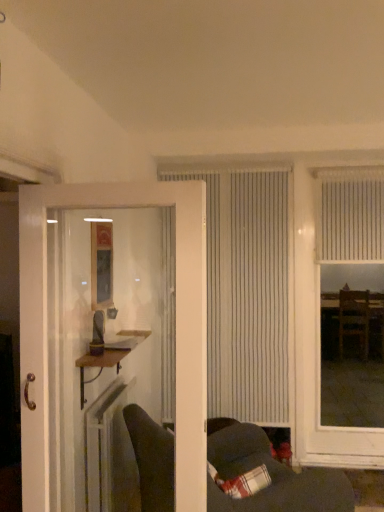
What do you see at coordinates (350, 215) in the screenshot? I see `white textured blind at upper right` at bounding box center [350, 215].

What is the approximate height of white plastic radiator at lower left?

32.47 inches.

At what (x,y) coordinates should I click in order to perform the action: click on dark gray fabric couch at lower center. Please return your answer as a coordinate pair (x, y). Looking at the image, I should click on (272, 477).

Locate an element on the screen. This screenshot has height=512, width=384. plaid fabric pillow at lower right is located at coordinates (242, 482).

Does white vertical blinds at right, which ranks as the first window in right-to-left order, turn towards white textured blind at upper right?

Result: Yes, white vertical blinds at right, which ranks as the first window in right-to-left order, is oriented towards white textured blind at upper right.

Consider the image. Considering the sizes of objects white vertical blinds at right, which ranks as the first window in right-to-left order, and white textured blind at upper right in the image provided, who is wider, white vertical blinds at right, which ranks as the first window in right-to-left order, or white textured blind at upper right?

white vertical blinds at right, which ranks as the first window in right-to-left order.

Considering the relative positions of white vertical blinds at right, placed as the second window when sorted from left to right, and white textured blind at upper right in the image provided, is white vertical blinds at right, placed as the second window when sorted from left to right, behind white textured blind at upper right?

That is False.

From the image's perspective, is white vertical blinds at right, which ranks as the first window in right-to-left order, located above white textured blind at upper right?

No, from the image's perspective, white vertical blinds at right, which ranks as the first window in right-to-left order, is not above white textured blind at upper right.

Consider the image. From a real-world perspective, which is physically above, dark gray fabric couch at lower center or white plastic radiator at lower left?

From a 3D spatial view, white plastic radiator at lower left is above.

Choose the correct answer: Is dark gray fabric couch at lower center inside white plastic radiator at lower left or outside it?

dark gray fabric couch at lower center lies outside white plastic radiator at lower left.

Is point (233, 446) positioned behind point (127, 450)?

Yes, point (233, 446) is farther from viewer.

From the image's perspective, between dark gray fabric couch at lower center and white plastic radiator at lower left, which one is located above?

white plastic radiator at lower left appears higher in the image.

Is white vertical blinds at right, placed as the second window when sorted from left to right, oriented towards wooden shelf at left?

No, white vertical blinds at right, placed as the second window when sorted from left to right, is not oriented towards wooden shelf at left.

Based on their positions, is white vertical blinds at right, which ranks as the first window in right-to-left order, located to the left or right of wooden shelf at left?

In the image, white vertical blinds at right, which ranks as the first window in right-to-left order, appears on the right side of wooden shelf at left.

Is white vertical blinds at right, which ranks as the first window in right-to-left order, outside of wooden shelf at left?

white vertical blinds at right, which ranks as the first window in right-to-left order, is positioned outside wooden shelf at left.

Image resolution: width=384 pixels, height=512 pixels. I want to click on table that appears on the left of white vertical blinds at right, placed as the second window when sorted from left to right, so click(108, 358).

Considering the points (36, 204) and (346, 195), which point is in front, point (36, 204) or point (346, 195)?

The point (36, 204) is closer.

Considering the sizes of white wooden door at left and white textured blind at upper right in the image, is white wooden door at left bigger or smaller than white textured blind at upper right?

Clearly, white wooden door at left is larger in size than white textured blind at upper right.

Between white wooden door at left and white textured blind at upper right, which one is positioned in front?

white wooden door at left.

From the image's perspective, which is above, wooden shelf at left or white vertical blinds at center, the second window viewed from the right?

white vertical blinds at center, the second window viewed from the right.

Is the position of wooden shelf at left more distant than that of white vertical blinds at center, the second window viewed from the right?

No, it is not.

Which point is more forward, (122,356) or (254,353)?

The point (122,356) is closer to the camera.

Is wooden shelf at left positioned with its back to white vertical blinds at center, the 1th window viewed from the left?

wooden shelf at left is not turned away from white vertical blinds at center, the 1th window viewed from the left.

From the image's perspective, is wooden shelf at left above or below dark gray fabric couch at lower center?

Based on their image positions, wooden shelf at left is located above dark gray fabric couch at lower center.

Can you see wooden shelf at left touching dark gray fabric couch at lower center?

No, wooden shelf at left is not with dark gray fabric couch at lower center.

Considering the relative sizes of wooden shelf at left and dark gray fabric couch at lower center in the image provided, is wooden shelf at left wider than dark gray fabric couch at lower center?

In fact, wooden shelf at left might be narrower than dark gray fabric couch at lower center.

Consider the image. Is dark gray fabric couch at lower center located within wooden shelf at left?

No, dark gray fabric couch at lower center is not a part of wooden shelf at left.

Locate an element on the screen. blind above the plaid fabric pillow at lower right (from the image's perspective) is located at coordinates (350, 215).

Is white textured blind at upper right turned away from plaid fabric pillow at lower right?

No, white textured blind at upper right's orientation is not away from plaid fabric pillow at lower right.

Is white textured blind at upper right far from plaid fabric pillow at lower right?

white textured blind at upper right is far away from plaid fabric pillow at lower right.

Which object is closer to the camera taking this photo, white textured blind at upper right or plaid fabric pillow at lower right?

plaid fabric pillow at lower right.

Where is `window in front of the white textured blind at upper right`? This screenshot has height=512, width=384. window in front of the white textured blind at upper right is located at coordinates (318, 351).

At what (x,y) coordinates should I click in order to perform the action: click on radiator behind the dark gray fabric couch at lower center. Please return your answer as a coordinate pair (x, y). Looking at the image, I should click on (109, 451).

When comparing their distances from white wooden door at left, does white vertical blinds at right, placed as the second window when sorted from left to right, or dark gray fabric couch at lower center seem closer?

dark gray fabric couch at lower center is positioned closer to the anchor white wooden door at left.

Looking at the image, which one is located further to dark gray fabric couch at lower center, white plastic radiator at lower left or white vertical blinds at center, the second window viewed from the right?

white vertical blinds at center, the second window viewed from the right, lies further to dark gray fabric couch at lower center than the other object.

Considering their positions, is white plastic radiator at lower left positioned closer to white vertical blinds at center, the second window viewed from the right, than white wooden door at left?

Among the two, white plastic radiator at lower left is located nearer to white vertical blinds at center, the second window viewed from the right.

Based on their spatial positions, is white plastic radiator at lower left or white wooden door at left closer to white vertical blinds at right, which ranks as the first window in right-to-left order?

white plastic radiator at lower left.

Considering their positions, is dark gray fabric couch at lower center positioned further to wooden shelf at left than white wooden door at left?

dark gray fabric couch at lower center is positioned further to the anchor wooden shelf at left.

From the image, which object appears to be nearer to dark gray fabric couch at lower center, white textured blind at upper right or white plastic radiator at lower left?

white plastic radiator at lower left is positioned closer to the anchor dark gray fabric couch at lower center.

From the image, which object appears to be farther from white wooden door at left, white vertical blinds at right, placed as the second window when sorted from left to right, or wooden shelf at left?

The object further to white wooden door at left is white vertical blinds at right, placed as the second window when sorted from left to right.

From the image, which object appears to be nearer to dark gray fabric couch at lower center, white wooden door at left or plaid fabric pillow at lower right?

Based on the image, plaid fabric pillow at lower right appears to be nearer to dark gray fabric couch at lower center.

Locate an element on the screen. pillow between wooden shelf at left and white vertical blinds at right, which ranks as the first window in right-to-left order is located at coordinates (242, 482).

You are a GUI agent. You are given a task and a screenshot of the screen. Output one action in this format:
    pyautogui.click(x=<x>, y=<y>)
    Task: Click on the radiator that lies between white wooden door at left and dark gray fabric couch at lower center from top to bottom
    
    Given the screenshot: What is the action you would take?
    pyautogui.click(x=109, y=451)

This screenshot has height=512, width=384. Find the location of `window positioned between dark gray fabric couch at lower center and white textured blind at upper right from near to far`. window positioned between dark gray fabric couch at lower center and white textured blind at upper right from near to far is located at coordinates (318, 351).

The image size is (384, 512). Identify the location of blind between white wooden door at left and white vertical blinds at center, the second window viewed from the right, along the z-axis. (350, 215).